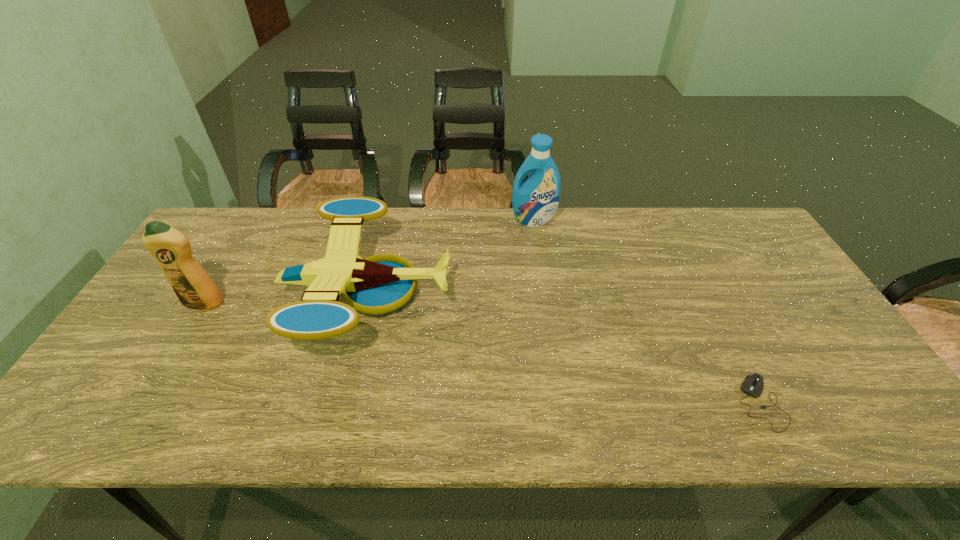
Locate an element on the screen. The height and width of the screenshot is (540, 960). the right detergent is located at coordinates (535, 201).

Image resolution: width=960 pixels, height=540 pixels. I want to click on the farther detergent, so click(535, 201).

The height and width of the screenshot is (540, 960). What are the coordinates of `the leftmost object` in the screenshot? It's located at [x=192, y=285].

This screenshot has height=540, width=960. Find the location of `the left detergent`. the left detergent is located at coordinates (192, 285).

At what (x,y) coordinates should I click in order to perform the action: click on the third object from right to left. Please return your answer as a coordinate pair (x, y). The width and height of the screenshot is (960, 540). Looking at the image, I should click on (379, 284).

Locate an element on the screen. The height and width of the screenshot is (540, 960). the second shortest object is located at coordinates (379, 284).

Locate an element on the screen. The width and height of the screenshot is (960, 540). the shortest object is located at coordinates (753, 384).

This screenshot has height=540, width=960. Find the location of `computer mouse`. computer mouse is located at coordinates (753, 384).

Find the location of a particular element. This screenshot has width=960, height=540. free location located 0.390m on the front-facing side of the farthest object is located at coordinates (548, 316).

I want to click on vacant area located 0.250m on the label of the nearer detergent, so click(x=149, y=394).